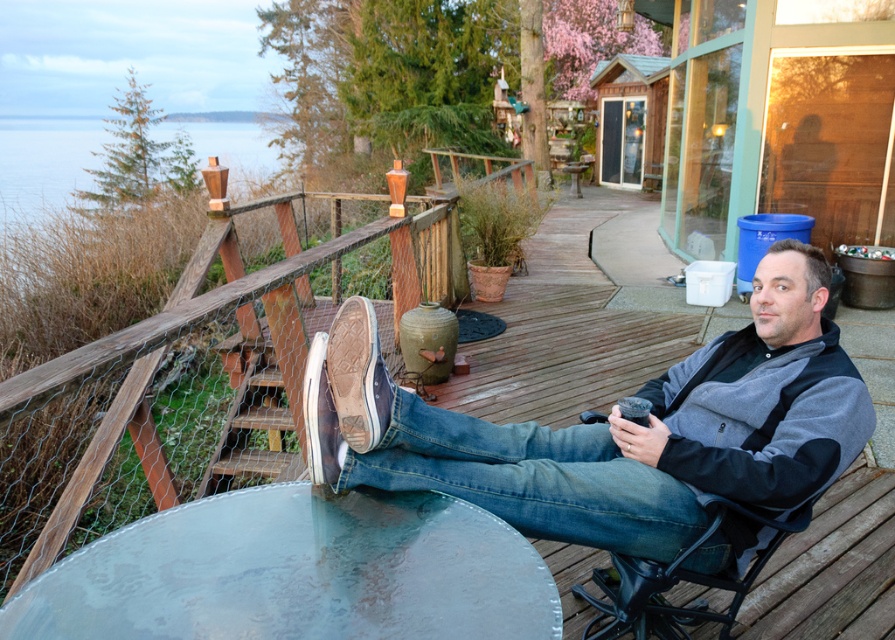
Is clear glass table at lower center in front of black metal chair at right?

Yes, clear glass table at lower center is in front of black metal chair at right.

Does clear glass table at lower center appear over black metal chair at right?

Yes.

Between point (480, 618) and point (714, 513), which one is positioned in front?

Point (480, 618) is more forward.

Where is `clear glass table at lower center`? The image size is (895, 640). clear glass table at lower center is located at coordinates (296, 572).

Is denim jeans at center positioned behind clear glass table at lower center?

Yes, it is.

Where is `denim jeans at center`? denim jeans at center is located at coordinates [618, 429].

Can you confirm if denim jeans at center is positioned to the left of black metal chair at right?

Correct, you'll find denim jeans at center to the left of black metal chair at right.

Can you confirm if denim jeans at center is positioned below black metal chair at right?

Incorrect, denim jeans at center is not positioned below black metal chair at right.

Locate an element on the screen. denim jeans at center is located at coordinates (618, 429).